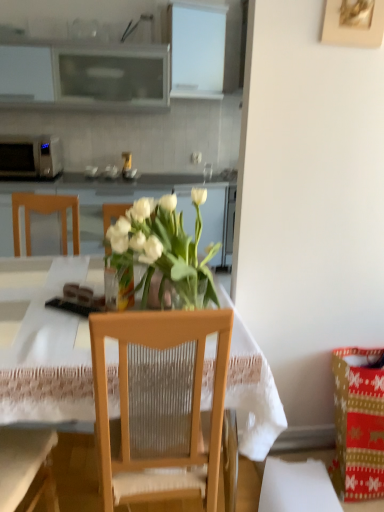
Question: Looking at the image, does matte glass coffee cup at center seem bigger or smaller compared to wooden chair at center?

Choices:
 (A) small
 (B) big

Answer: (A)

Question: In terms of width, does matte glass coffee cup at center look wider or thinner when compared to wooden chair at center?

Choices:
 (A) thin
 (B) wide

Answer: (A)

Question: Based on their relative distances, which object is nearer to the clear glass vase at center?

Choices:
 (A) wooden chair at center
 (B) wooden picture frame at upper right
 (C) matte glass coffee cup at center
 (D) transparent glass vase at center
 (E) white glossy cabinet at center

Answer: (D)

Question: Which object is the closest to the wooden chair at center?

Choices:
 (A) transparent glass vase at center
 (B) matte glass coffee cup at center
 (C) white matte microwave oven at left
 (D) wooden picture frame at upper right
 (E) clear glass vase at center

Answer: (A)